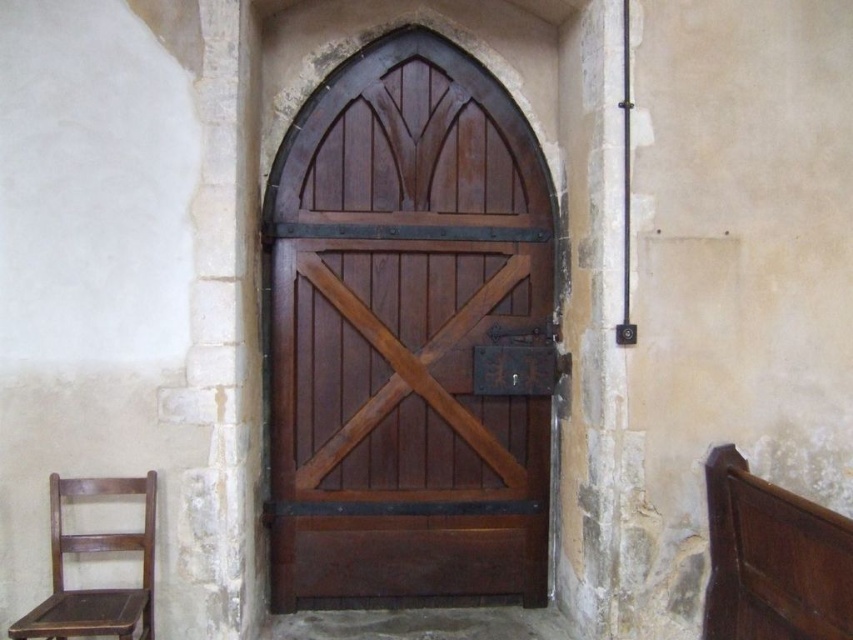
You are a delivery person trying to bring a large package through the satin wood door at center. The wooden chair at left is blocking the doorway. If you move the chair out of the way, will the package fit through the doorway?

The satin wood door at center might be wider than wooden chair at left. If the door is indeed wider, the package could fit through the doorway after moving the chair. However, since the exact width difference isn

You are standing in front of the satin wood door at center and want to move to the wooden chair at left. Is the door blocking your path?

The satin wood door at center is positioned over the wooden chair at left, so the door is blocking your path to the chair.